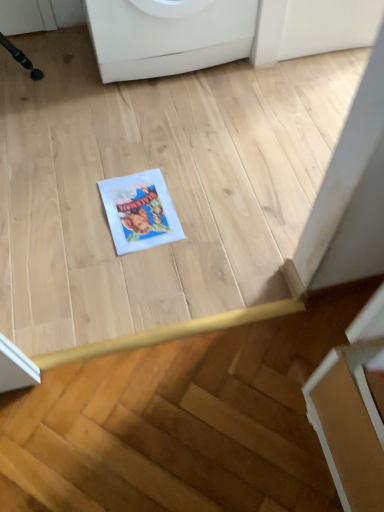
Question: In the image, is white glossy washing machine at upper center on the left side or the right side of white paper comic book at center?

Choices:
 (A) right
 (B) left

Answer: (A)

Question: Is white glossy washing machine at upper center spatially inside white paper comic book at center, or outside of it?

Choices:
 (A) inside
 (B) outside

Answer: (B)

Question: In terms of width, does white glossy washing machine at upper center look wider or thinner when compared to white paper comic book at center?

Choices:
 (A) wide
 (B) thin

Answer: (A)

Question: Is white paper comic book at center wider or thinner than white glossy washing machine at upper center?

Choices:
 (A) wide
 (B) thin

Answer: (B)

Question: Is white paper comic book at center to the left or to the right of white glossy washing machine at upper center in the image?

Choices:
 (A) right
 (B) left

Answer: (B)

Question: In terms of height, does white paper comic book at center look taller or shorter compared to white glossy washing machine at upper center?

Choices:
 (A) tall
 (B) short

Answer: (B)

Question: Based on their sizes in the image, would you say white paper comic book at center is bigger or smaller than white glossy washing machine at upper center?

Choices:
 (A) big
 (B) small

Answer: (B)